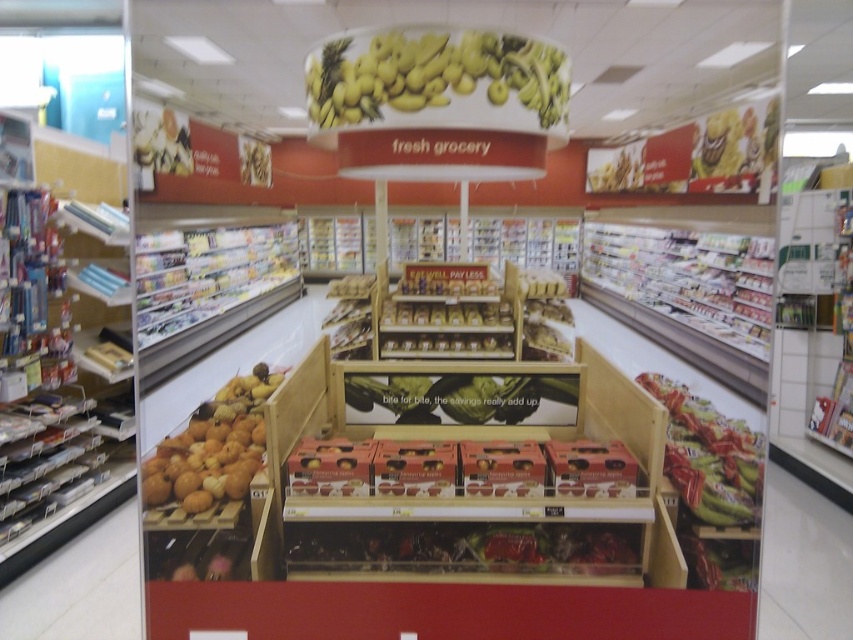
Question: Considering the real-world distances, which object is closest to the matte cardboard boxes at center?

Choices:
 (A) green matte leaf at center
 (B) shiny red bag at right
 (C) metallic silver shelves at left

Answer: (A)

Question: Which of the following is the closest to the observer?

Choices:
 (A) (221, 394)
 (B) (737, 477)
 (C) (636, 524)
 (D) (471, 35)

Answer: (D)

Question: Is shiny plastic berries at center positioned in front of metallic gold snack at center?

Choices:
 (A) no
 (B) yes

Answer: (B)

Question: Does shiny plastic berries at center come behind green matte leaf at center?

Choices:
 (A) no
 (B) yes

Answer: (A)

Question: Can you confirm if shiny plastic berries at center is smaller than metallic gold snack at center?

Choices:
 (A) no
 (B) yes

Answer: (B)

Question: Which object is the closest to the metallic silver shelves at left?

Choices:
 (A) shiny plastic berries at center
 (B) shiny red bag at right
 (C) yellow matte bananas at upper center
 (D) green matte leaf at center

Answer: (D)